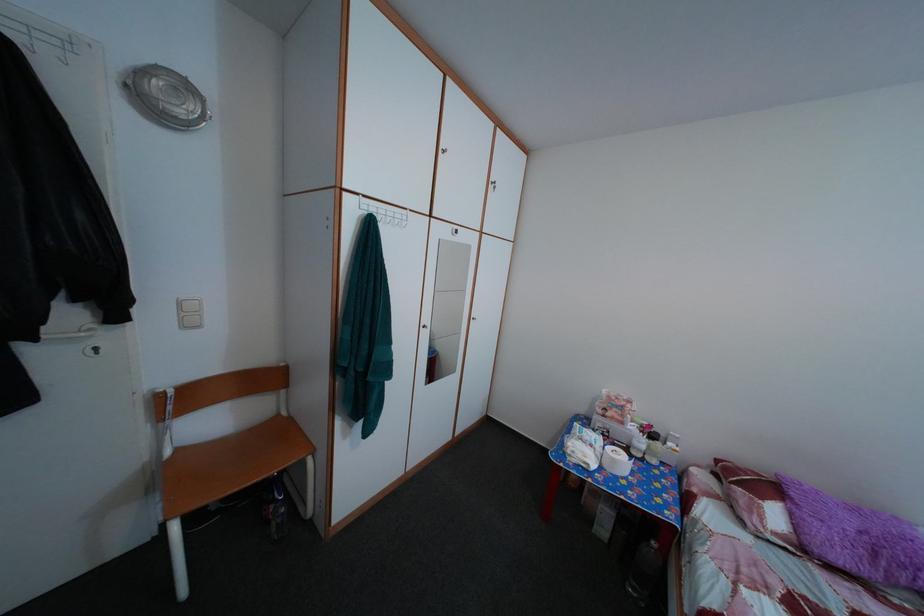
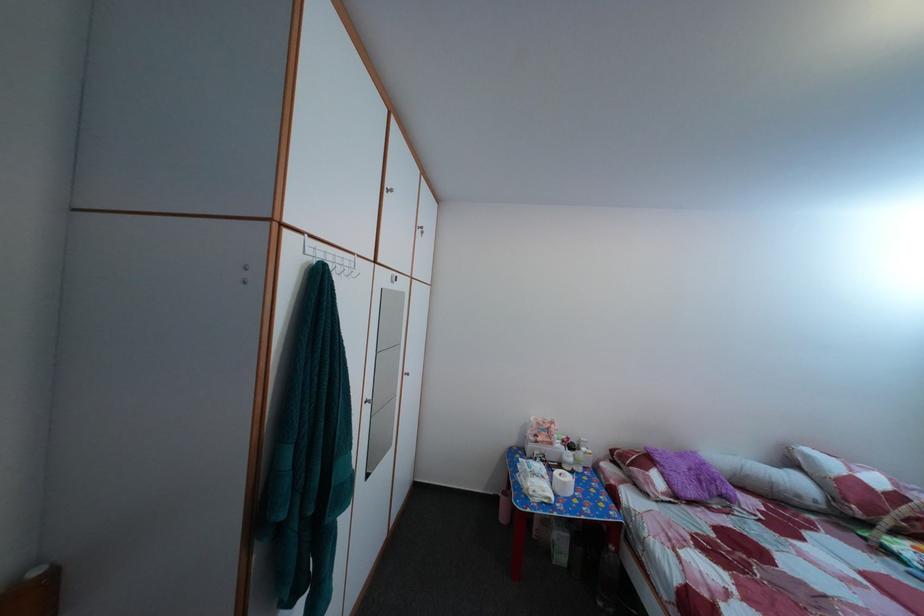
The point at (617, 445) is marked in the first image. Where is the corresponding point in the second image?

(555, 469)